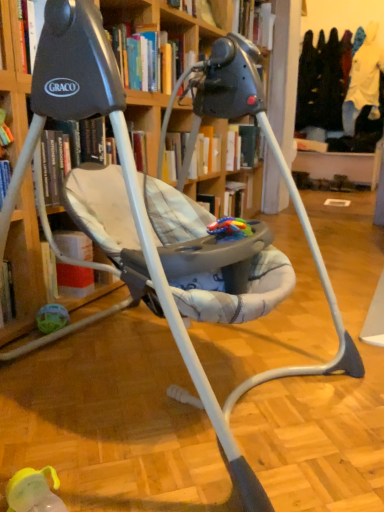
Question: Is hardcover book at upper center, which ranks as the 3th book in right-to-left order, at the back of hardcover book at upper center, arranged as the 3th book when viewed from the front?

Choices:
 (A) yes
 (B) no

Answer: (B)

Question: Can you confirm if hardcover book at upper center, the first book viewed from the back, is positioned to the right of hardcover book at upper center, marked as the first book in a left-to-right arrangement?

Choices:
 (A) yes
 (B) no

Answer: (A)

Question: Is hardcover book at upper center, arranged as the 3th book when viewed from the front, at the left side of hardcover book at upper center, the first book from the front?

Choices:
 (A) yes
 (B) no

Answer: (B)

Question: Is hardcover book at upper center, positioned as the third book in bottom-to-top order, wider than hardcover book at upper center, the first book from the front?

Choices:
 (A) yes
 (B) no

Answer: (B)

Question: Can you confirm if hardcover book at upper center, which is the third book in left-to-right order, is smaller than hardcover book at upper center, the first book from the front?

Choices:
 (A) yes
 (B) no

Answer: (A)

Question: From the image's perspective, relative to hardcover book at upper center, which appears as the 2th book when viewed from the back, is hardcover book at upper center, the first book from the right, above or below?

Choices:
 (A) above
 (B) below

Answer: (A)

Question: Considering the positions of hardcover book at upper center, arranged as the 3th book when viewed from the front, and hardcover book at upper center, which ranks as the second book in left-to-right order, in the image, is hardcover book at upper center, arranged as the 3th book when viewed from the front, bigger or smaller than hardcover book at upper center, which ranks as the second book in left-to-right order,?

Choices:
 (A) small
 (B) big

Answer: (B)

Question: Considering their positions, is hardcover book at upper center, arranged as the 3th book when viewed from the front, located in front of or behind hardcover book at upper center, placed as the 2th book when sorted from right to left?

Choices:
 (A) behind
 (B) front

Answer: (A)

Question: Is hardcover book at upper center, arranged as the 3th book when viewed from the front, to the left or to the right of hardcover book at upper center, which ranks as the second book in bottom-to-top order, in the image?

Choices:
 (A) right
 (B) left

Answer: (A)

Question: In the image, is hardcover book at upper center, the first book from the right, on the left side or the right side of hardcover book at upper center, which ranks as the 3th book in top-to-bottom order?

Choices:
 (A) left
 (B) right

Answer: (B)

Question: Is hardcover book at upper center, the first book viewed from the back, wider or thinner than hardcover book at upper center, the first book from the front?

Choices:
 (A) wide
 (B) thin

Answer: (B)

Question: From the image's perspective, is hardcover book at upper center, which is the first book in top-to-bottom order, located above or below hardcover book at upper center, which ranks as the 3th book in top-to-bottom order?

Choices:
 (A) below
 (B) above

Answer: (B)

Question: Considering the positions of hardcover book at upper center, arranged as the 3th book when viewed from the front, and hardcover book at upper center, marked as the 1th book in a bottom-to-top arrangement, in the image, is hardcover book at upper center, arranged as the 3th book when viewed from the front, taller or shorter than hardcover book at upper center, marked as the 1th book in a bottom-to-top arrangement,?

Choices:
 (A) tall
 (B) short

Answer: (A)

Question: In the image, is hardcover book at upper center, the 2th book when ordered from top to bottom, positioned in front of or behind hardcover book at upper center, arranged as the 3th book when viewed from the front?

Choices:
 (A) front
 (B) behind

Answer: (A)

Question: In terms of width, does hardcover book at upper center, which ranks as the second book in bottom-to-top order, look wider or thinner when compared to hardcover book at upper center, the first book from the right?

Choices:
 (A) wide
 (B) thin

Answer: (B)